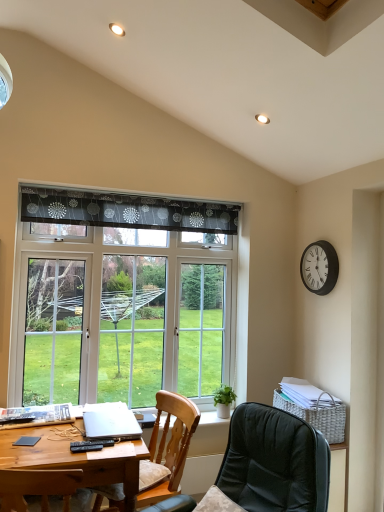
Question: Is transparent glass window at center far away from leather-like black chair at lower center, placed as the 2th chair when sorted from back to front?

Choices:
 (A) no
 (B) yes

Answer: (B)

Question: Does transparent glass window at center lie in front of leather-like black chair at lower center, placed as the 2th chair when sorted from back to front?

Choices:
 (A) yes
 (B) no

Answer: (B)

Question: Is transparent glass window at center behind leather-like black chair at lower center, the first chair positioned from the front?

Choices:
 (A) no
 (B) yes

Answer: (B)

Question: Does transparent glass window at center contain leather-like black chair at lower center, placed as the 2th chair when sorted from back to front?

Choices:
 (A) no
 (B) yes

Answer: (A)

Question: Is transparent glass window at center taller than leather-like black chair at lower center, the first chair positioned from the front?

Choices:
 (A) no
 (B) yes

Answer: (B)

Question: Looking at the image, does silver metallic laptop at lower left seem bigger or smaller compared to white wicker picnic basket at lower right?

Choices:
 (A) big
 (B) small

Answer: (B)

Question: Would you say silver metallic laptop at lower left is inside or outside white wicker picnic basket at lower right?

Choices:
 (A) outside
 (B) inside

Answer: (A)

Question: Is silver metallic laptop at lower left to the left or to the right of white wicker picnic basket at lower right in the image?

Choices:
 (A) right
 (B) left

Answer: (B)

Question: In terms of height, does silver metallic laptop at lower left look taller or shorter compared to white wicker picnic basket at lower right?

Choices:
 (A) short
 (B) tall

Answer: (A)

Question: In terms of height, does transparent glass window at center look taller or shorter compared to leather-like black chair at lower center, the first chair positioned from the front?

Choices:
 (A) short
 (B) tall

Answer: (B)

Question: Considering the positions of transparent glass window at center and leather-like black chair at lower center, placed as the 2th chair when sorted from back to front, in the image, is transparent glass window at center wider or thinner than leather-like black chair at lower center, placed as the 2th chair when sorted from back to front,?

Choices:
 (A) wide
 (B) thin

Answer: (B)

Question: Choose the correct answer: Is transparent glass window at center inside leather-like black chair at lower center, the first chair positioned from the front, or outside it?

Choices:
 (A) outside
 (B) inside

Answer: (A)

Question: From the image's perspective, is transparent glass window at center positioned above or below leather-like black chair at lower center, placed as the 2th chair when sorted from back to front?

Choices:
 (A) below
 (B) above

Answer: (B)

Question: Is white wicker picnic basket at lower right situated inside black metal clock at upper right or outside?

Choices:
 (A) outside
 (B) inside

Answer: (A)

Question: Is white wicker picnic basket at lower right bigger or smaller than black metal clock at upper right?

Choices:
 (A) big
 (B) small

Answer: (A)